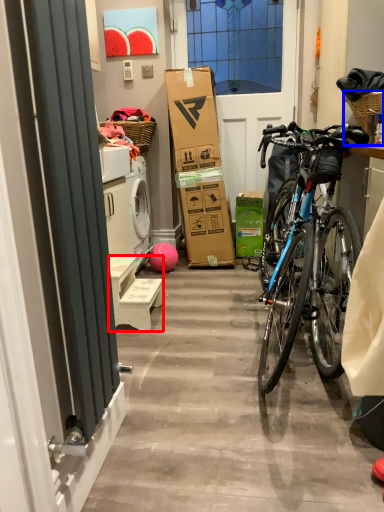
Question: Which object appears closest to the camera in this image, furniture (highlighted by a red box) or picnic basket (highlighted by a blue box)?

Choices:
 (A) furniture
 (B) picnic basket

Answer: (B)